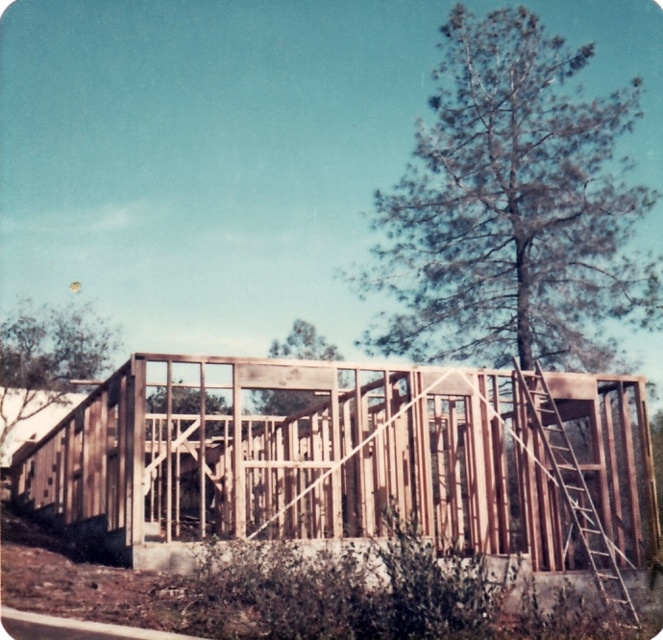
You are a construction worker inspecting the partially built wooden structure. You notice the brown wooden frame at center and the wooden at right. Which one is bigger in size?

The brown wooden frame at center is larger in size compared to the wooden at right.